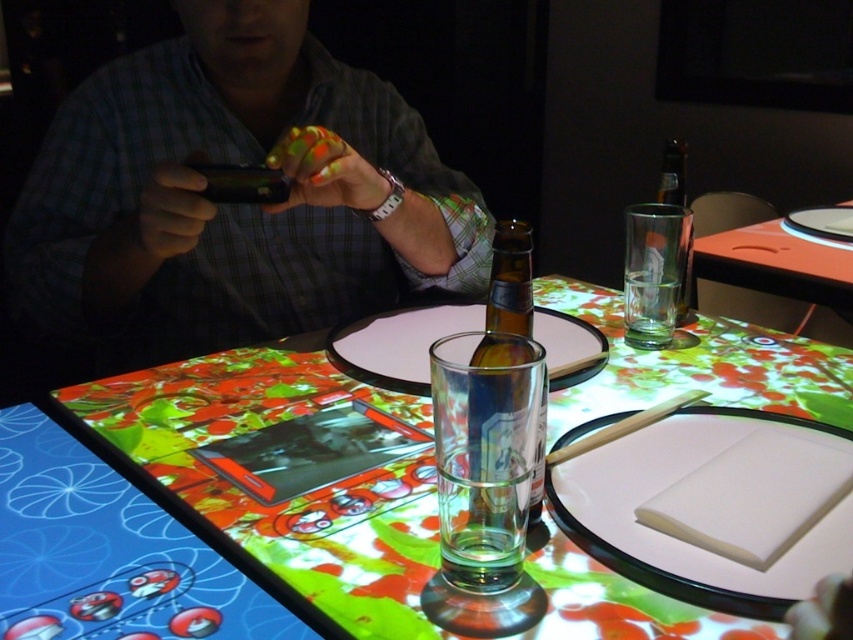
You are trying to place a small decorative item between the translucent glass beer bottle at center and the tablet device on the table. Given that the item is 3 inches wide, will there be enough space?

The distance between the translucent glass beer bottle at center and the tablet device is 15.64 inches, which is more than enough to accommodate a 3 inch wide decorative item.

You are sitting at the table and want to place your phone in a specific location. The coordinates given are point (231, 204). Where exactly on the table would this point be located?

The coordinates point (231, 204) correspond to the matte black phone at upper left, so placing your phone there would position it at the upper left corner of the table.

You are a bartender preparing drinks for a customer seated at the table. You need to choose a taller bottle to pour a drink into the taller glass. Which bottle should you select between the translucent glass beer bottle at center and the translucent glass bottle at upper right?

The translucent glass bottle at upper right is taller than the translucent glass beer bottle at center, so you should select the translucent glass bottle at upper right to pour the drink into the taller glass.